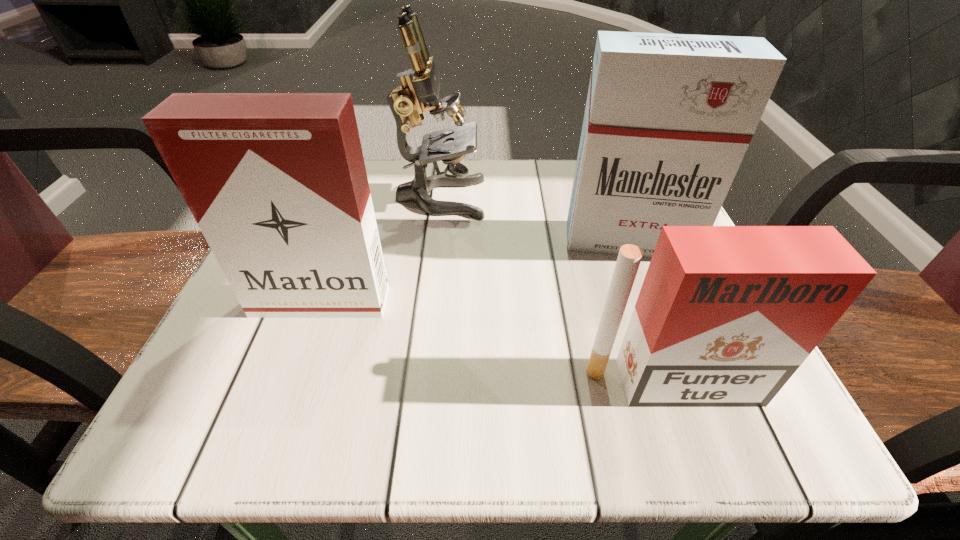
At what (x,y) coordinates should I click in order to perform the action: click on vacant area between the nearest object and the farthest object. Please return your answer as a coordinate pair (x, y). Image resolution: width=960 pixels, height=540 pixels. Looking at the image, I should click on (556, 291).

Where is `free space between the microscope and the farthest cigarette case`? free space between the microscope and the farthest cigarette case is located at coordinates (535, 219).

The height and width of the screenshot is (540, 960). What are the coordinates of `object that can be found as the third closest to the microscope` in the screenshot? It's located at (725, 316).

Identify which object is the nearest to the microscope. Please provide its 2D coordinates. Your answer should be formatted as a tuple, i.e. [(x, y)], where the tuple contains the x and y coordinates of a point satisfying the conditions above.

[(668, 119)]

Identify the location of the third closest cigarette case relative to the farthest object. (725, 316).

Identify which cigarette case is located as the nearest to the farthest object. Please provide its 2D coordinates. Your answer should be formatted as a tuple, i.e. [(x, y)], where the tuple contains the x and y coordinates of a point satisfying the conditions above.

[(668, 119)]

Find the location of a particular element. This screenshot has width=960, height=540. free point that satisfies the following two spatial constraints: 1. at the eyepieces of the farthest cigarette case; 2. on the left side of the farthest object is located at coordinates (436, 240).

The width and height of the screenshot is (960, 540). What are the coordinates of `free space that satisfies the following two spatial constraints: 1. at the eyepieces of the farthest cigarette case; 2. on the right side of the farthest object` in the screenshot? It's located at click(436, 240).

Image resolution: width=960 pixels, height=540 pixels. In order to click on vacant space that satisfies the following two spatial constraints: 1. at the eyepieces of the microscope; 2. on the front-facing side of the leftmost cigarette case in this screenshot , I will do `click(428, 302)`.

I want to click on free point that satisfies the following two spatial constraints: 1. at the eyepieces of the farthest object; 2. on the left side of the second farthest object, so click(436, 240).